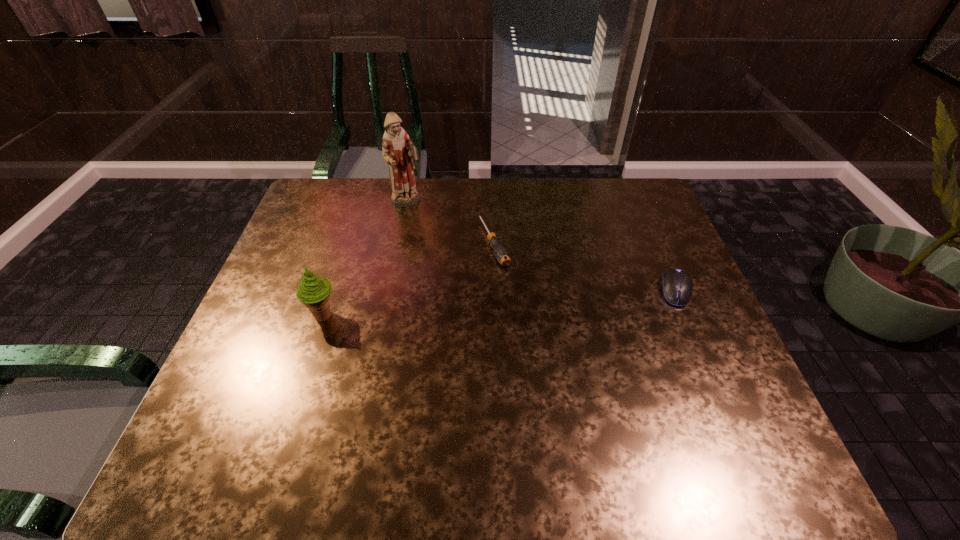
Image resolution: width=960 pixels, height=540 pixels. I want to click on vacant spot on the desktop that is between the leftmost object and the rightmost object and is positioned on the front-facing side of the figurine, so click(x=496, y=303).

In order to click on vacant space on the desktop that is between the icecream and the rightmost object and is positioned at the tip of the third object from left to right in this screenshot , I will do `click(526, 301)`.